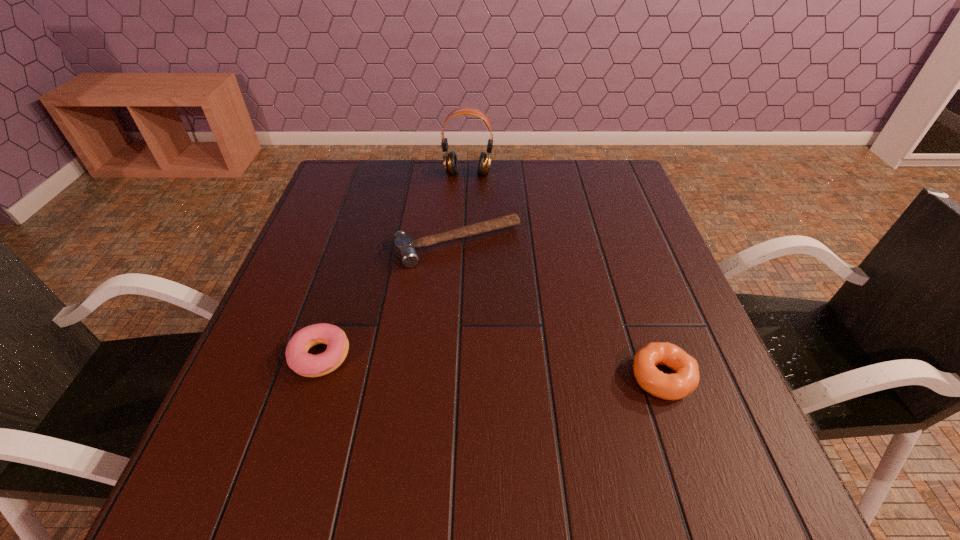
The image size is (960, 540). I want to click on the leftmost object, so click(x=308, y=365).

Locate an element on the screen. The width and height of the screenshot is (960, 540). the right doughnut is located at coordinates (679, 385).

Locate an element on the screen. The image size is (960, 540). the second farthest object is located at coordinates (404, 245).

You are a GUI agent. You are given a task and a screenshot of the screen. Output one action in this format:
    pyautogui.click(x=<x>, y=<y>)
    Task: Click on the shortest object
    
    Given the screenshot: What is the action you would take?
    pyautogui.click(x=404, y=245)

The width and height of the screenshot is (960, 540). Identify the location of headset. (450, 160).

Image resolution: width=960 pixels, height=540 pixels. I want to click on the farthest object, so click(450, 160).

This screenshot has height=540, width=960. I want to click on free space located on the front of the left doughnut, so click(294, 438).

In order to click on free space located 0.350m on the left of the rightmost object in this screenshot , I will do `click(447, 377)`.

The width and height of the screenshot is (960, 540). I want to click on vacant space situated on the striking face of the shortest object, so click(549, 381).

This screenshot has height=540, width=960. Identify the location of vacant region located 0.330m on the striking face of the shortest object. (547, 377).